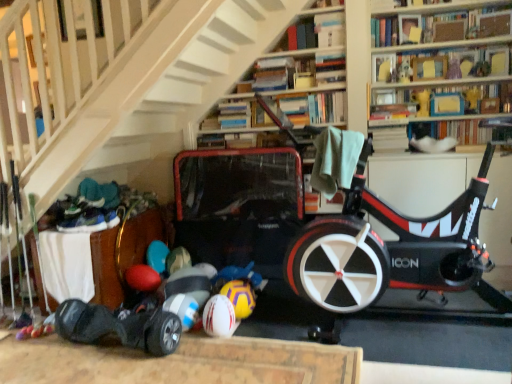
I want to click on empty space that is in between yellowtexturebeach ball at lower center and white matte rugby ball at lower center, so click(x=238, y=332).